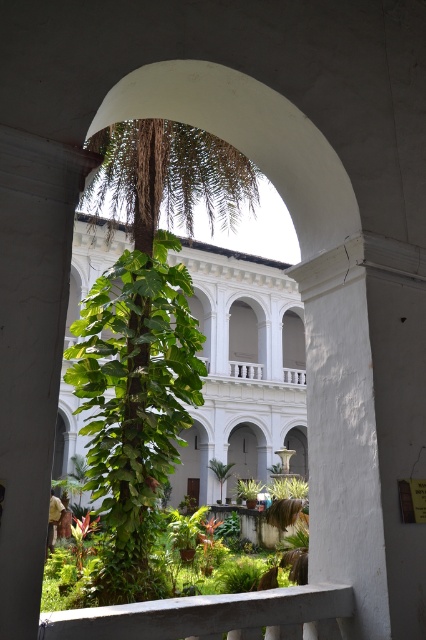
Between point (328, 560) and point (271, 605), which one is positioned behind?

Positioned behind is point (328, 560).

This screenshot has height=640, width=426. Find the location of `white smooth pillar at right`. white smooth pillar at right is located at coordinates (345, 429).

Which is below, green leafy plant at center or white smooth pillar at right?

green leafy plant at center is lower down.

Is point (97, 380) in front of point (363, 614)?

No, (97, 380) is further to viewer.

Between point (123, 305) and point (359, 234), which one is positioned in front?

Point (359, 234)

The width and height of the screenshot is (426, 640). I want to click on green leafy plant at center, so click(x=135, y=404).

Is the position of green leafy plant at center less distant than that of white concrete balustrade at lower center?

No, green leafy plant at center is behind white concrete balustrade at lower center.

Does green leafy plant at center have a smaller size compared to white concrete balustrade at lower center?

No, green leafy plant at center is not smaller than white concrete balustrade at lower center.

Locate an element on the screen. The height and width of the screenshot is (640, 426). green leafy plant at center is located at coordinates (135, 404).